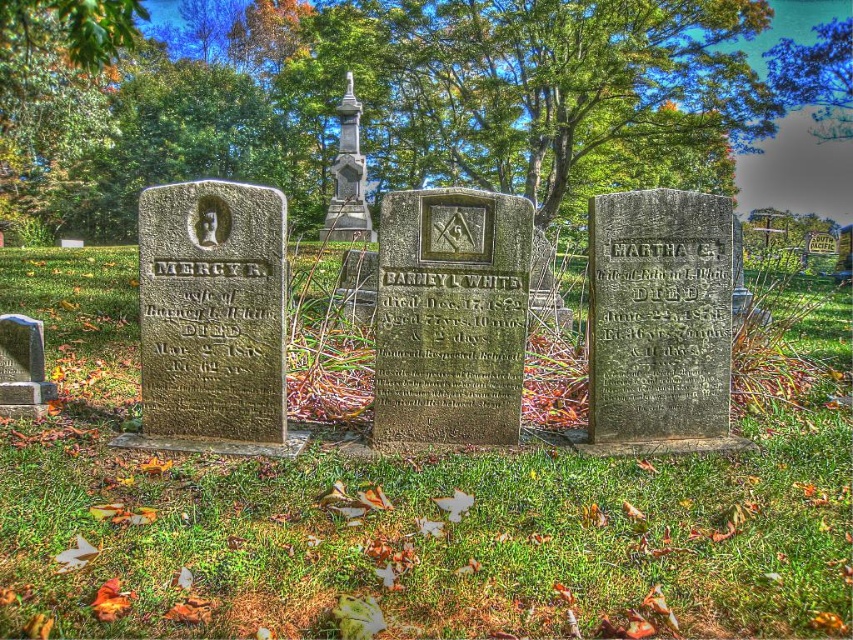
You are standing in the cemetery and want to touch both the granite gravestone at center and the green stone gravestone at left. Which one would you reach first?

You would reach the granite gravestone at center first because it is closer to you than the green stone gravestone at left, which is further away.

Consider the image. You are standing at the edge of the cemetery and want to place a wreath on the green grass at center. According to the coordinates provided, where exactly should you place it?

The green grass at center is located at point (x=392, y=513), so you should place the wreath there.